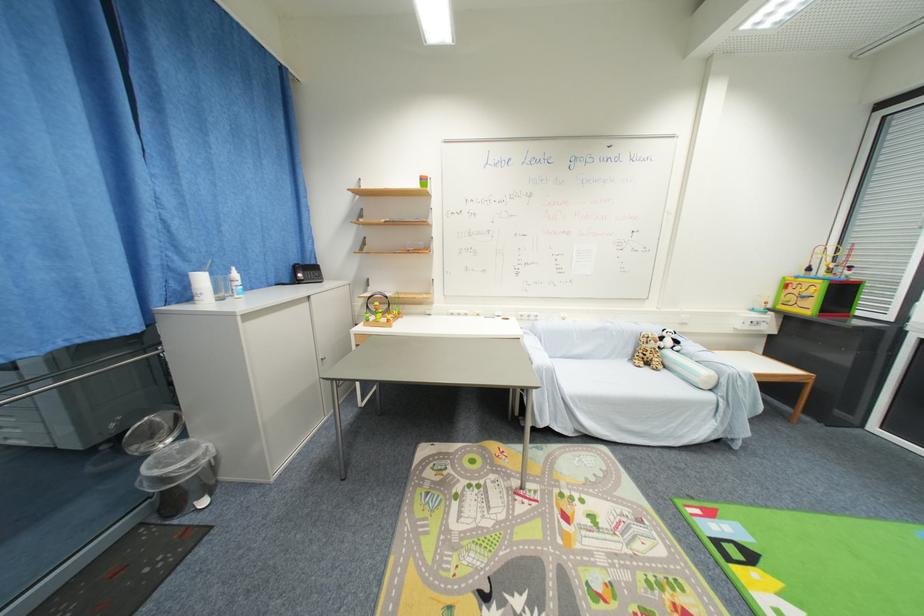
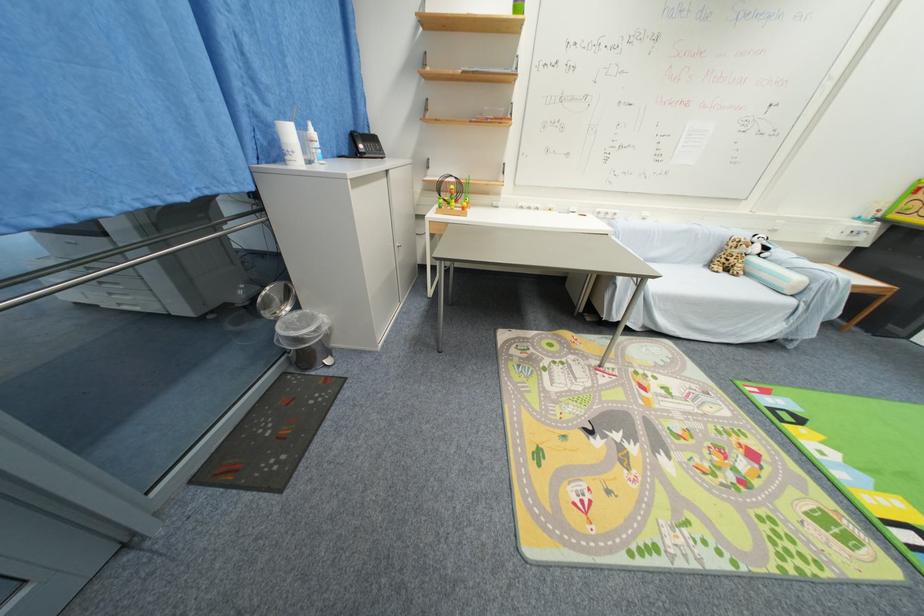
Question: The images are taken continuously from a first-person perspective. In which direction are you moving?

Choices:
 (A) Left
 (B) Right
 (C) Forward
 (D) Backward

Answer: (A)